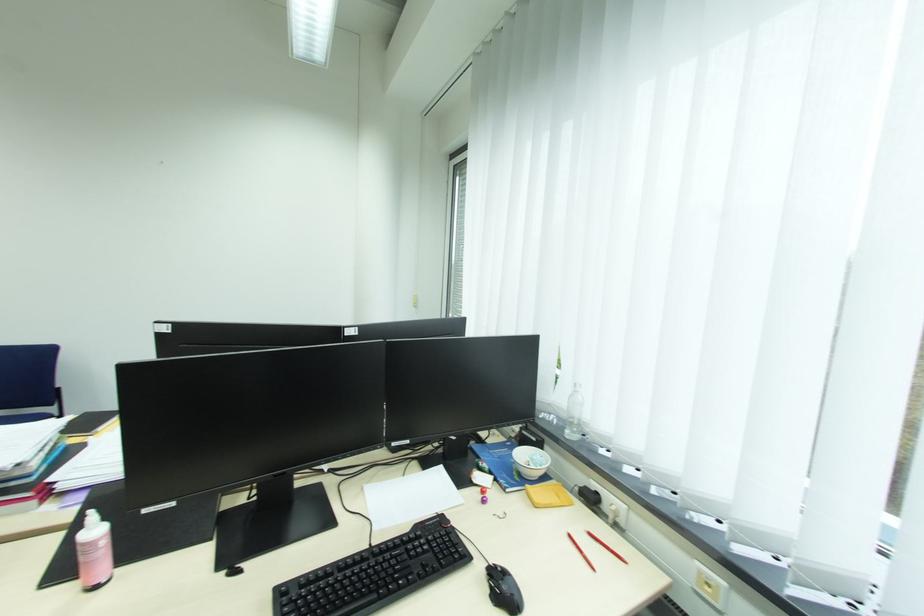
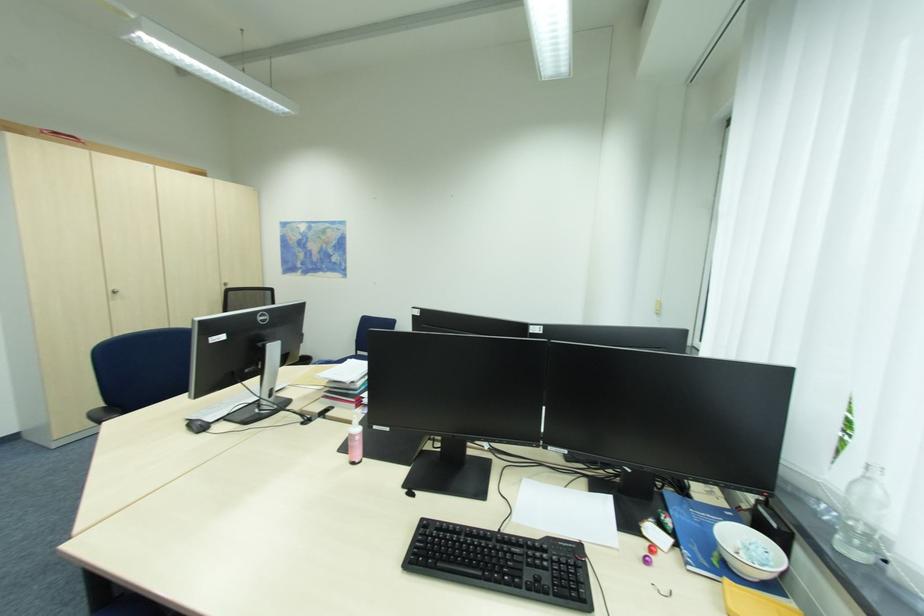
Question: The camera is either moving clockwise (left) or counter-clockwise (right) around the object. The first image is from the beginning of the video and the second image is from the end. Is the camera moving left or right when shooting the video?

Choices:
 (A) Left
 (B) Right

Answer: (B)